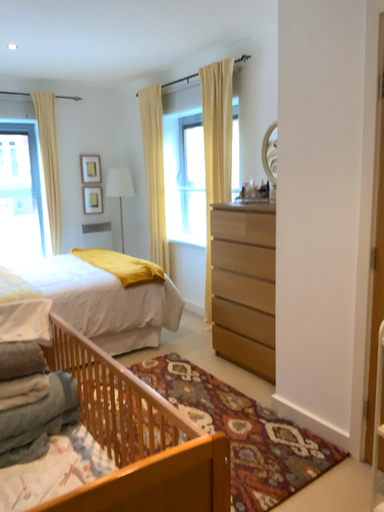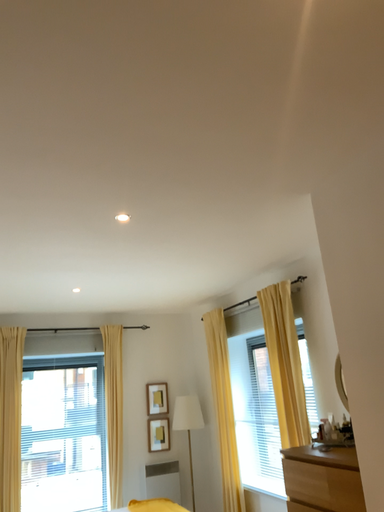
Question: Which way did the camera rotate in the video?

Choices:
 (A) rotated right
 (B) rotated left

Answer: (B)